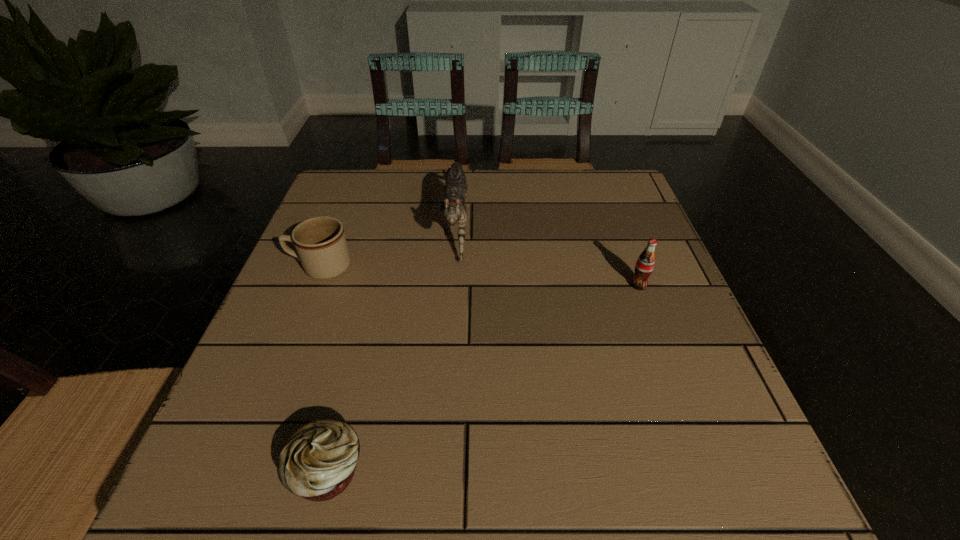
The image size is (960, 540). What are the coordinates of `object that is at the far edge` in the screenshot? It's located at (453, 209).

The width and height of the screenshot is (960, 540). In order to click on object located in the near edge section of the desktop in this screenshot , I will do pos(318,461).

At what (x,y) coordinates should I click in order to perform the action: click on mug that is at the left edge. Please return your answer as a coordinate pair (x, y). Looking at the image, I should click on (320, 242).

Locate an element on the screen. muffin that is at the left edge is located at coordinates (318, 461).

The height and width of the screenshot is (540, 960). Identify the location of object positioned at the right edge. (645, 263).

Find the location of a particular element. object that is at the near left corner is located at coordinates (318, 461).

The height and width of the screenshot is (540, 960). I want to click on vacant space at the far edge, so click(414, 192).

Identify the location of free space at the near edge of the desktop. (558, 449).

In the image, there is a desktop. Where is `vacant space at the left edge`? This screenshot has width=960, height=540. vacant space at the left edge is located at coordinates (290, 323).

In the image, there is a desktop. Find the location of `vacant region at the right edge`. vacant region at the right edge is located at coordinates (621, 246).